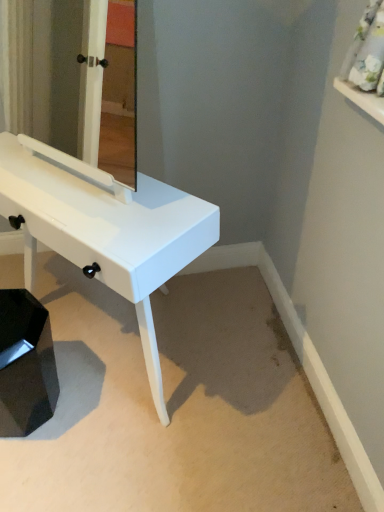
The height and width of the screenshot is (512, 384). I want to click on white glossy mirror at center, so click(x=76, y=80).

The height and width of the screenshot is (512, 384). What do you see at coordinates (76, 80) in the screenshot? I see `white glossy mirror at center` at bounding box center [76, 80].

What is the approximate width of white glossy table at center?

The width of white glossy table at center is 19.27 inches.

Locate an element on the screen. Image resolution: width=384 pixels, height=512 pixels. white glossy table at center is located at coordinates (106, 230).

Find the location of a particular element. The width and height of the screenshot is (384, 512). white glossy mirror at center is located at coordinates (76, 80).

Between black glossy step stool at lower left and white glossy mirror at center, which one has less height?

black glossy step stool at lower left.

Which object is positioned more to the left, black glossy step stool at lower left or white glossy mirror at center?

black glossy step stool at lower left is more to the left.

From the image's perspective, relative to white glossy mirror at center, is black glossy step stool at lower left above or below?

From the image's perspective, black glossy step stool at lower left appears below white glossy mirror at center.

From the image's perspective, which is above, black glossy step stool at lower left or white glossy table at center?

From the image's view, white glossy table at center is above.

Where is `step stool that appears on the left of white glossy table at center`? step stool that appears on the left of white glossy table at center is located at coordinates (25, 364).

Is black glossy step stool at lower left with white glossy table at center?

No, black glossy step stool at lower left is not with white glossy table at center.

From a real-world perspective, who is located lower, black glossy step stool at lower left or white glossy table at center?

From a 3D spatial view, black glossy step stool at lower left is below.

Which object is thinner, white glossy table at center or white glossy mirror at center?

white glossy mirror at center.

Is white glossy table at center shorter than white glossy mirror at center?

No.

In the scene shown: Considering the positions of objects white glossy table at center and white glossy mirror at center in the image provided, who is more to the left, white glossy table at center or white glossy mirror at center?

From the viewer's perspective, white glossy table at center appears more on the left side.

Considering the points (182, 222) and (73, 67), which point is behind, point (182, 222) or point (73, 67)?

Positioned behind is point (73, 67).

Identify the location of mirror in front of the white glossy table at center. (76, 80).

Does white glossy mirror at center contain white glossy table at center?

→ No, white glossy table at center is located outside of white glossy mirror at center.

Which object is further away from the camera taking this photo, white glossy mirror at center or white glossy table at center?

white glossy table at center is more distant.

Are white glossy mirror at center and white glossy table at center far apart?

That's right, there is a large distance between white glossy mirror at center and white glossy table at center.

You are a GUI agent. You are given a task and a screenshot of the screen. Output one action in this format:
    pyautogui.click(x=<x>, y=<y>)
    Task: Click on the step stool below the white glossy table at center (from a real-world perspective)
    The height and width of the screenshot is (512, 384).
    Given the screenshot: What is the action you would take?
    click(x=25, y=364)

From the image's perspective, between white glossy table at center and black glossy step stool at lower left, which one is located above?

white glossy table at center, from the image's perspective.

From a real-world perspective, does white glossy table at center sit lower than black glossy step stool at lower left?

No.

Who is shorter, white glossy mirror at center or black glossy step stool at lower left?

With less height is black glossy step stool at lower left.

This screenshot has height=512, width=384. Identify the location of mirror above the black glossy step stool at lower left (from a real-world perspective). (76, 80).

From the image's perspective, is white glossy mirror at center positioned above or below black glossy step stool at lower left?

white glossy mirror at center is situated higher than black glossy step stool at lower left in the image.

Would you consider white glossy mirror at center to be distant from black glossy step stool at lower left?

Absolutely, white glossy mirror at center is distant from black glossy step stool at lower left.

Identify the location of step stool below the white glossy mirror at center (from the image's perspective). (25, 364).

Where is `table located in front of the black glossy step stool at lower left`? This screenshot has height=512, width=384. table located in front of the black glossy step stool at lower left is located at coordinates (106, 230).

Based on their spatial positions, is black glossy step stool at lower left or white glossy table at center closer to white glossy mirror at center?

black glossy step stool at lower left lies closer to white glossy mirror at center than the other object.

Based on their spatial positions, is white glossy mirror at center or black glossy step stool at lower left further from white glossy table at center?

white glossy mirror at center lies further to white glossy table at center than the other object.

Considering their positions, is white glossy table at center positioned closer to black glossy step stool at lower left than white glossy mirror at center?

white glossy table at center is positioned closer to the anchor black glossy step stool at lower left.

Based on the photo, estimate the real-world distances between objects in this image. Which object is closer to white glossy table at center, black glossy step stool at lower left or white glossy mirror at center?

Based on the image, black glossy step stool at lower left appears to be nearer to white glossy table at center.

Considering their positions, is white glossy mirror at center positioned closer to black glossy step stool at lower left than white glossy table at center?

Based on the image, white glossy table at center appears to be nearer to black glossy step stool at lower left.

From the image, which object appears to be farther from white glossy mirror at center, white glossy table at center or black glossy step stool at lower left?

white glossy table at center is further to white glossy mirror at center.

Locate an element on the screen. table between white glossy mirror at center and black glossy step stool at lower left vertically is located at coordinates (106, 230).